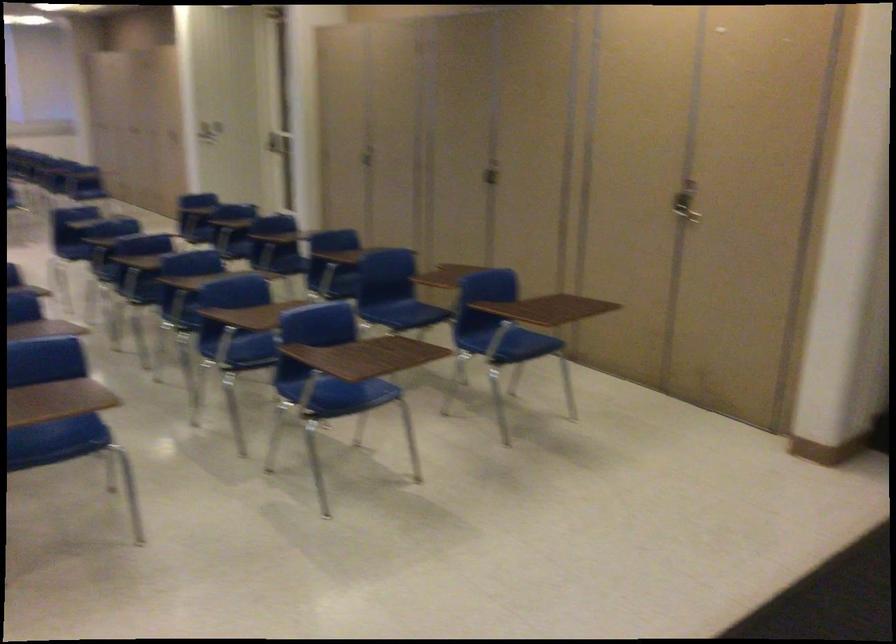
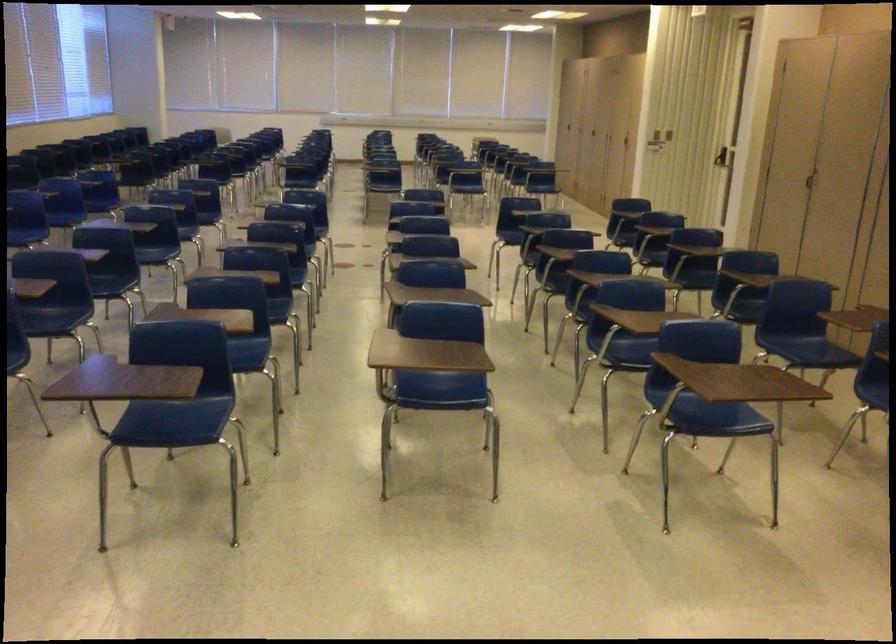
Question: How did the camera likely rotate?

Choices:
 (A) Left
 (B) Right
 (C) Up
 (D) Down

Answer: (A)